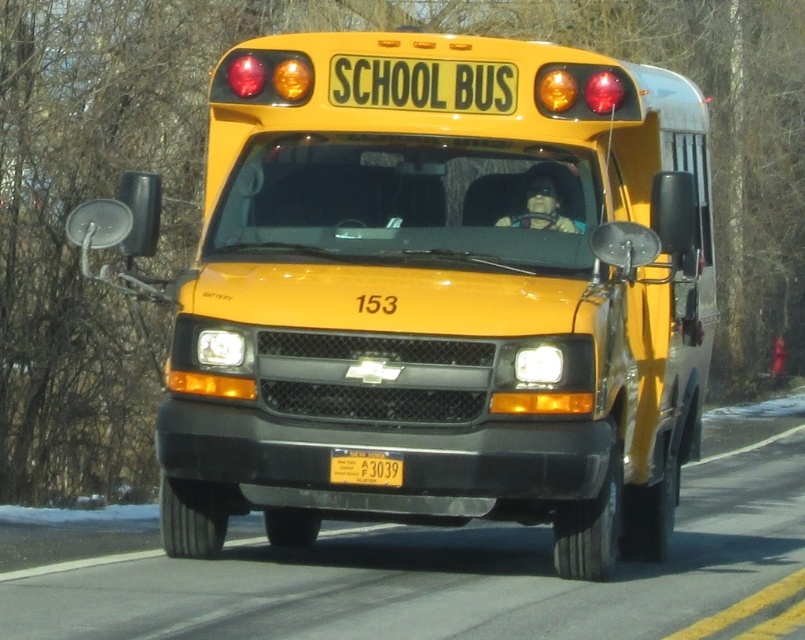
You are a traffic officer checking license plates on yellow matte school buses. You see the yellow matte school bus at center and the yellow matte license plate at center. Where is the license plate located relative to the school bus?

The yellow matte license plate at center is located below the yellow matte school bus at center.

You are standing at the point labeled as point [432,291] in the image. What object are you currently located on?

The point [432,291] corresponds to the yellow matte school bus at center.

You are a photographer trying to capture the entire yellow matte school bus at center and the yellow matte license plate at center in a single frame. Given that your camera can only focus on objects within a 200 cm width, will both objects fit in the frame?

The yellow matte school bus at center is larger in size than the yellow matte license plate at center. Since the camera can focus on objects within a 200 cm width, both objects can fit in the frame as the school bus is the larger object and it can be accommodated within the 200 cm limit.